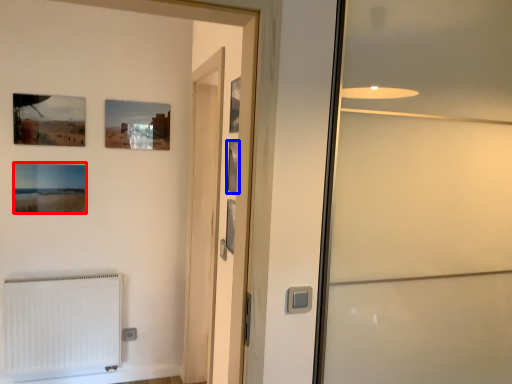
Question: Which point is closer to the camera, picture frame (highlighted by a red box) or picture frame (highlighted by a blue box)?

Choices:
 (A) picture frame
 (B) picture frame

Answer: (B)